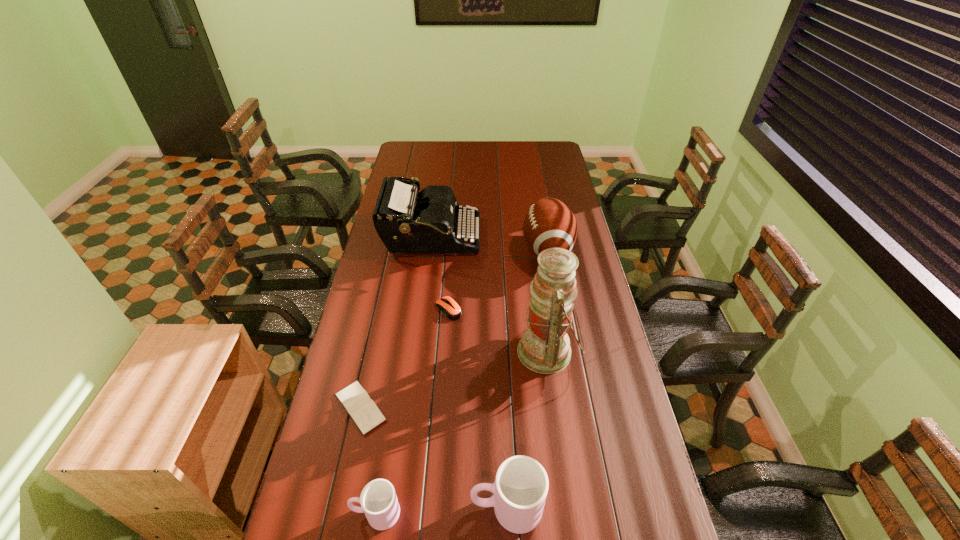
Locate an element on the screen. free space located 0.320m on the back of the diary is located at coordinates pos(383,307).

Find the location of `cup that is at the left edge`. cup that is at the left edge is located at coordinates (378, 500).

This screenshot has width=960, height=540. What are the coordinates of `typewriter that is at the left edge` in the screenshot? It's located at (406, 224).

Where is `diary that is at the left edge`? diary that is at the left edge is located at coordinates (356, 401).

Locate an element on the screen. This screenshot has height=540, width=960. football located in the right edge section of the desktop is located at coordinates (549, 223).

Locate an element on the screen. oil lamp that is at the right edge is located at coordinates (544, 347).

You are a GUI agent. You are given a task and a screenshot of the screen. Output one action in this format:
    pyautogui.click(x=<x>, y=<y>)
    Task: Click on the object that is at the near left corner
    This screenshot has width=960, height=540.
    Given the screenshot: What is the action you would take?
    pyautogui.click(x=378, y=500)

You are a GUI agent. You are given a task and a screenshot of the screen. Output one action in this format:
    pyautogui.click(x=<x>, y=<y>)
    Task: Click on the free region at the far edge
    
    Given the screenshot: What is the action you would take?
    pyautogui.click(x=502, y=148)

Where is `free space at the left edge of the desktop`? The height and width of the screenshot is (540, 960). free space at the left edge of the desktop is located at coordinates (351, 332).

Image resolution: width=960 pixels, height=540 pixels. In the image, there is a desktop. What are the coordinates of `vacant space at the right edge` in the screenshot? It's located at (556, 184).